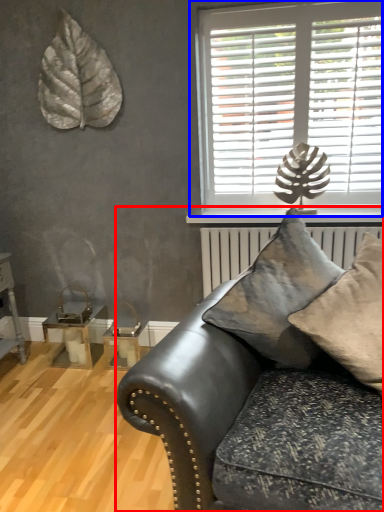
Question: Among these objects, which one is nearest to the camera, studio couch (highlighted by a red box) or window (highlighted by a blue box)?

Choices:
 (A) studio couch
 (B) window

Answer: (A)